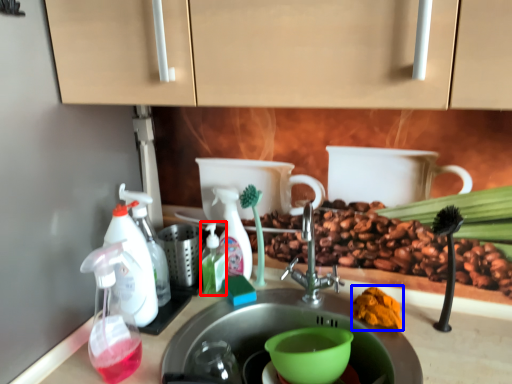
Question: Which object appears closest to the camera in this image, soap dispenser (highlighted by a red box) or debris (highlighted by a blue box)?

Choices:
 (A) soap dispenser
 (B) debris

Answer: (B)